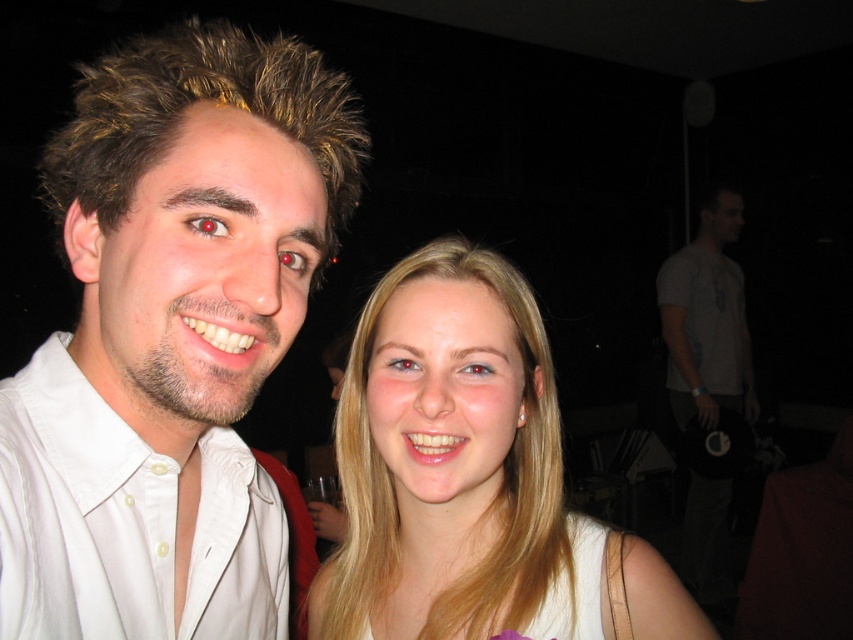
Does blonde hair at center appear on the right side of white cotton shirt at left?

Yes, blonde hair at center is to the right of white cotton shirt at left.

Is point (341, 616) closer to viewer compared to point (224, 545)?

No, it is behind (224, 545).

Which is behind, point (451, 577) or point (42, 568)?

Positioned behind is point (451, 577).

The height and width of the screenshot is (640, 853). I want to click on blonde hair at center, so click(x=471, y=477).

Is point (486, 557) positioned after point (704, 376)?

That is False.

Between point (535, 308) and point (708, 353), which one is positioned behind?

Positioned behind is point (708, 353).

Locate an element on the screen. This screenshot has height=640, width=853. blonde hair at center is located at coordinates (471, 477).

Is point (222, 451) less distant than point (720, 264)?

Yes, point (222, 451) is in front of point (720, 264).

Image resolution: width=853 pixels, height=640 pixels. I want to click on white cotton shirt at left, so click(x=125, y=522).